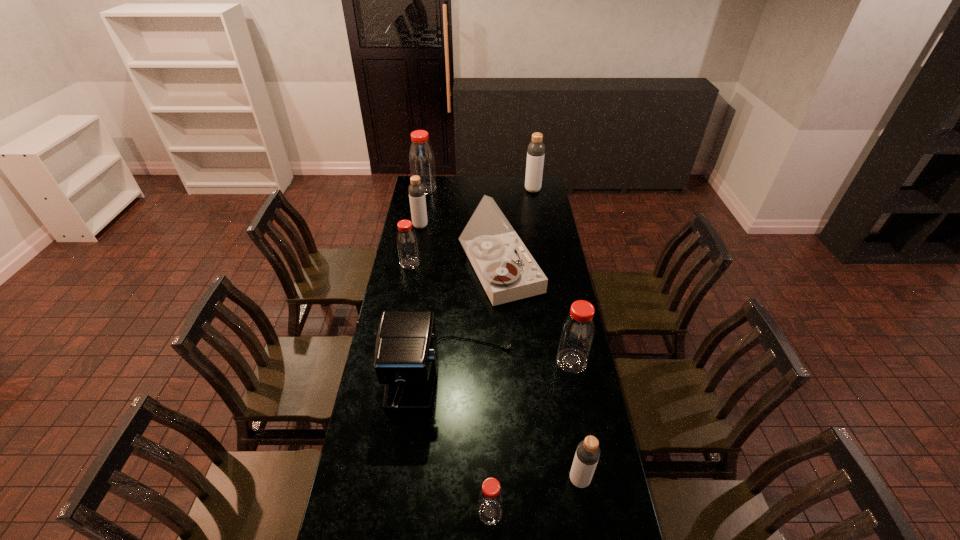
Find the location of a particular element. Image resolution: width=960 pixels, height=540 pixels. red bottle that is the third closest to the nearest bottle is located at coordinates (421, 157).

Point out which gray bottle is positioned as the third nearest to the second nearest red bottle. Please provide its 2D coordinates. Your answer should be formatted as a tuple, i.e. [(x, y)], where the tuple contains the x and y coordinates of a point satisfying the conditions above.

[(536, 149)]

What are the coordinates of `the third closest gray bottle to the white record player` in the screenshot? It's located at (587, 454).

I want to click on vacant position in the image that satisfies the following two spatial constraints: 1. on the front side of the nearest bottle; 2. on the left side of the third biggest red bottle, so click(x=364, y=512).

The height and width of the screenshot is (540, 960). I want to click on vacant space that satisfies the following two spatial constraints: 1. on the front side of the second nearest bottle; 2. on the right side of the second smallest red bottle, so click(x=371, y=480).

Image resolution: width=960 pixels, height=540 pixels. Identify the location of free point that satisfies the following two spatial constraints: 1. on the front side of the biggest red bottle; 2. on the right side of the white record player. (409, 275).

At what (x,y) coordinates should I click in order to perform the action: click on vacant area that satisfies the following two spatial constraints: 1. on the front-facing side of the nearest object; 2. on the right side of the black coffee maker. Please return your answer as a coordinate pair (x, y). The width and height of the screenshot is (960, 540). Looking at the image, I should click on (442, 512).